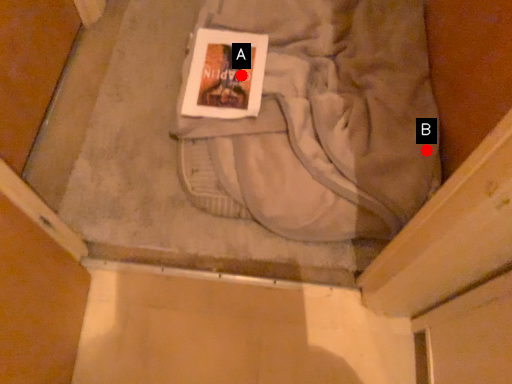
Question: Two points are circled on the image, labeled by A and B beside each circle. Which point appears farthest from the camera in this image?

Choices:
 (A) A is further
 (B) B is further

Answer: (A)